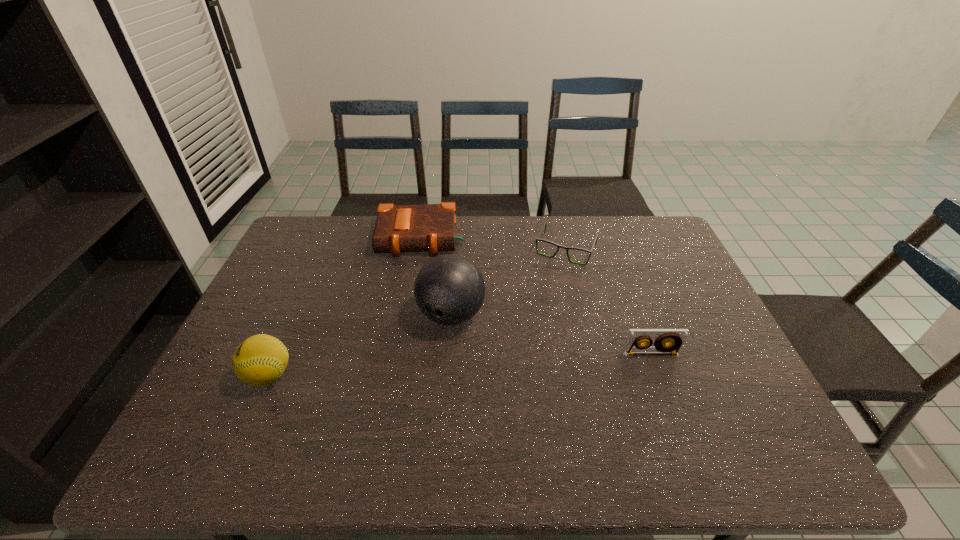
You are a GUI agent. You are given a task and a screenshot of the screen. Output one action in this format:
    pyautogui.click(x=<x>, y=<y>)
    Task: Click on the vacant space at the far right corner of the desktop
    
    Given the screenshot: What is the action you would take?
    pyautogui.click(x=641, y=222)

Image resolution: width=960 pixels, height=540 pixels. Identify the location of vacant area between the tallest object and the leftmost object. (360, 345).

Locate an element on the screen. The width and height of the screenshot is (960, 540). vacant point located between the spectacles and the bowling ball is located at coordinates (509, 282).

Locate an element on the screen. Image resolution: width=960 pixels, height=540 pixels. free space between the leftmost object and the bowling ball is located at coordinates [x=360, y=345].

In order to click on vacant space that is in between the videotape and the tallest object in this screenshot , I will do `click(551, 335)`.

Find the location of a particular element. free space between the videotape and the second tallest object is located at coordinates (460, 365).

Image resolution: width=960 pixels, height=540 pixels. I want to click on free spot between the leftmost object and the videotape, so click(x=460, y=365).

Locate an element on the screen. The image size is (960, 540). blank region between the leftmost object and the second shortest object is located at coordinates (345, 307).

What are the coordinates of `empty space between the third nearest object and the spectacles` in the screenshot? It's located at (509, 282).

Image resolution: width=960 pixels, height=540 pixels. I want to click on free space that is in between the tallest object and the softball, so click(360, 345).